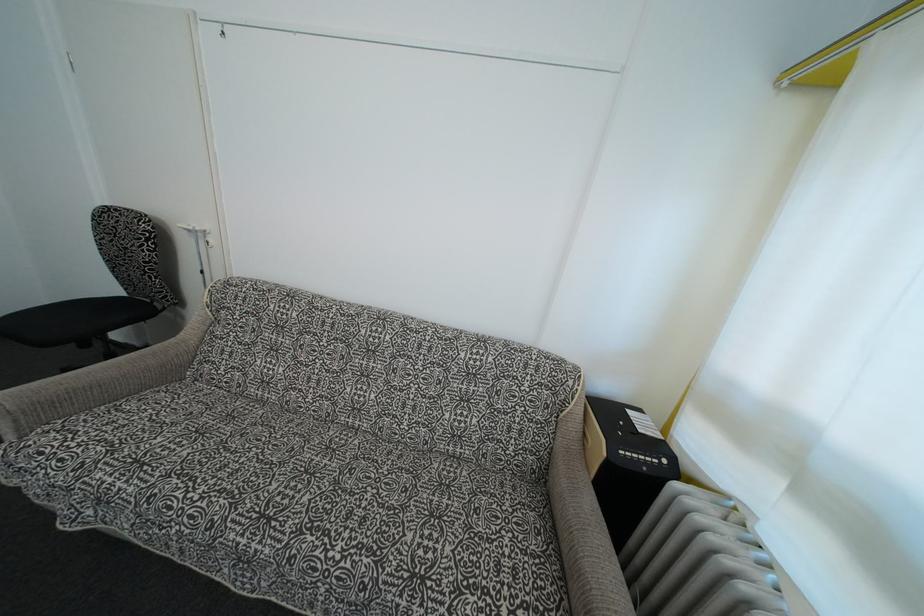
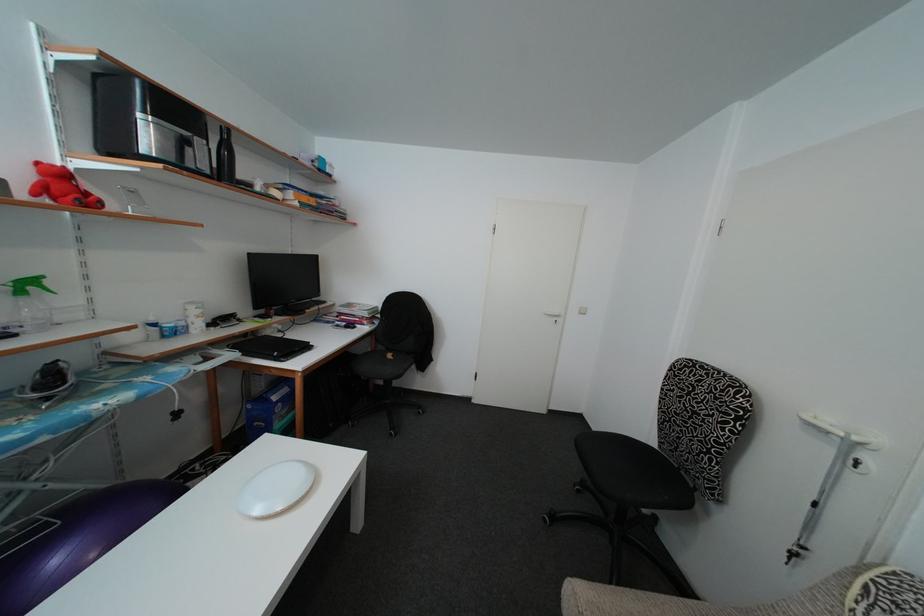
Question: The images are taken continuously from a first-person perspective. In which direction is your viewpoint rotating?

Choices:
 (A) Left
 (B) Right
 (C) Up
 (D) Down

Answer: (A)